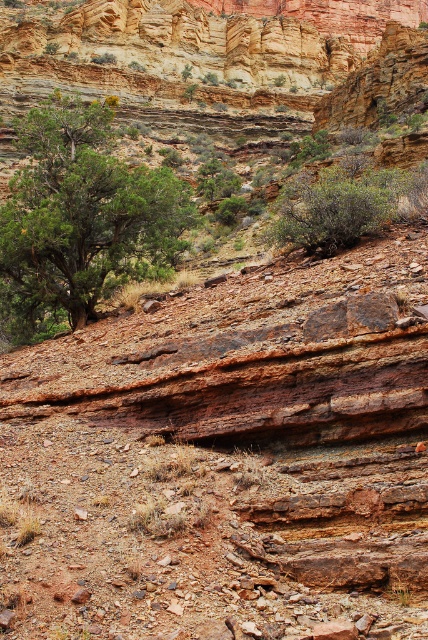
Between green leafy tree at left and green leafy bush at center, which one appears on the left side from the viewer's perspective?

green leafy tree at left is more to the left.

Which of these two, green leafy tree at left or green leafy bush at center, stands taller?

Standing taller between the two is green leafy tree at left.

At what (x,y) coordinates should I click in order to perform the action: click on green leafy tree at left. Please return your answer as a coordinate pair (x, y). The width and height of the screenshot is (428, 640). Looking at the image, I should click on (85, 212).